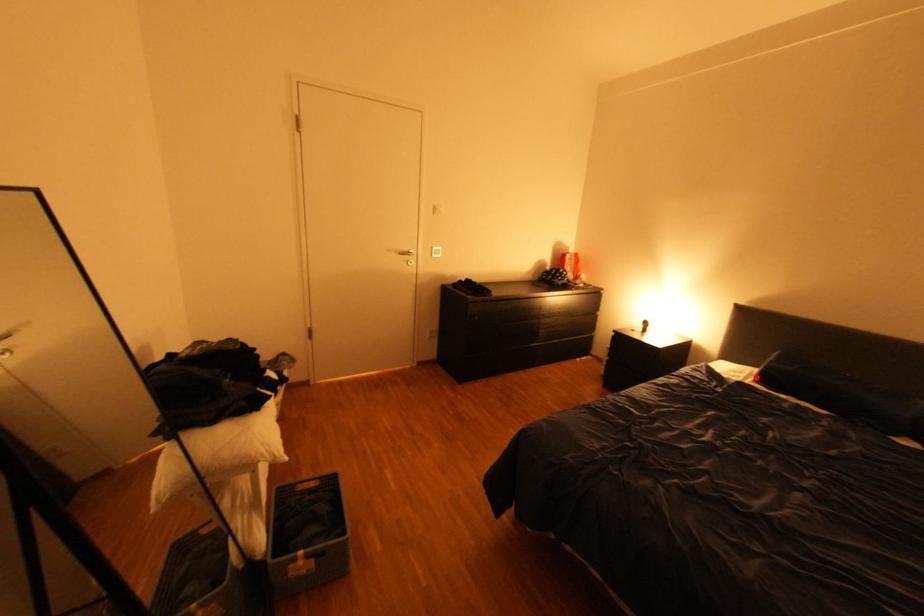
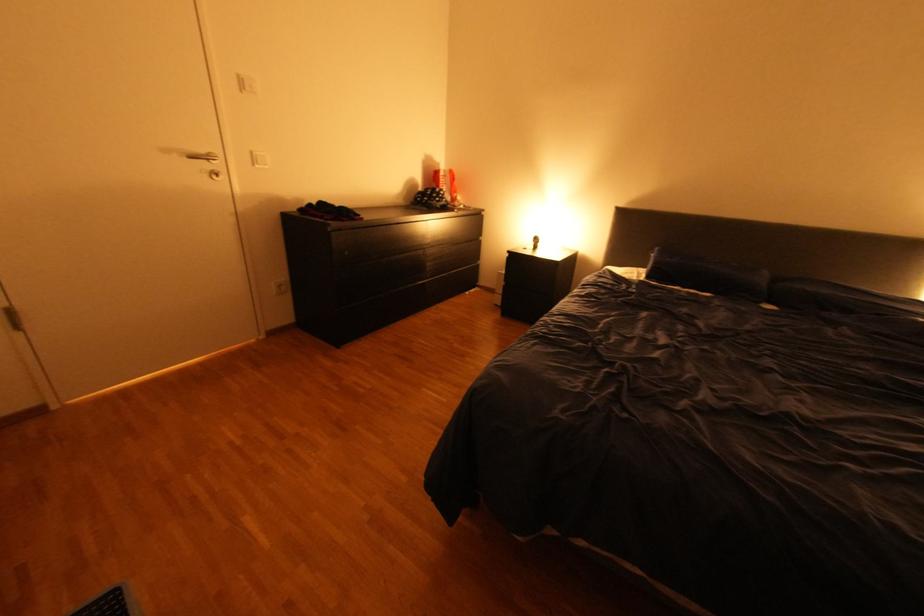
Where in the second image is the point corresponding to the highlighted location from the first image?

(648, 277)